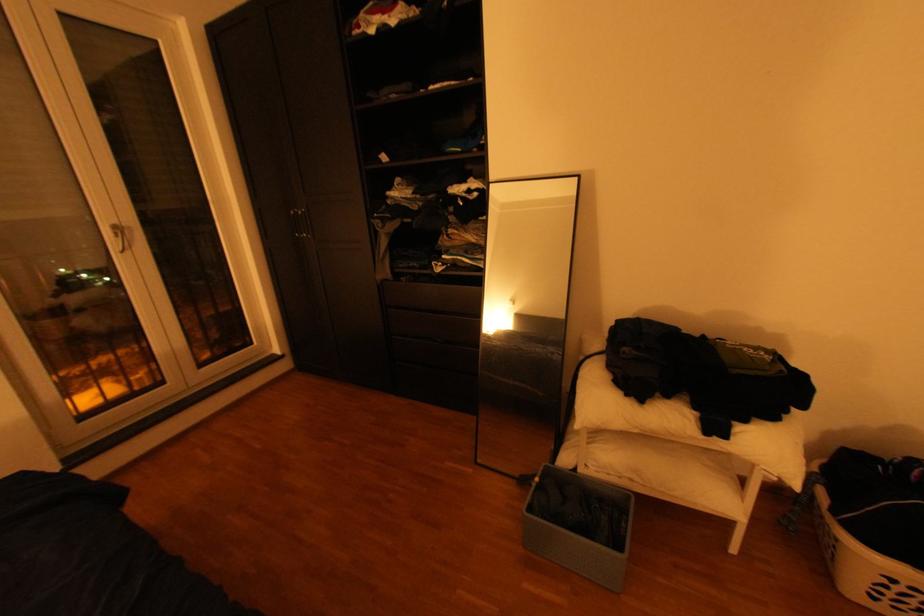
Find where to lift the basket handle cutout. Please return your answer as a coordinate pair (x, y).

(872, 503)